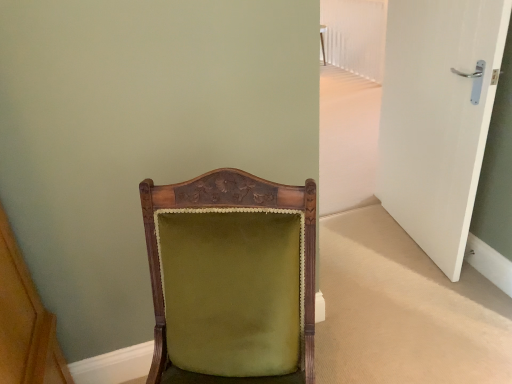
Question: Should I look upward or downward to see velvet green chair at center?

Choices:
 (A) down
 (B) up

Answer: (A)

Question: Considering the relative positions of velvet green chair at center and white glossy door at right in the image provided, is velvet green chair at center in front of white glossy door at right?

Choices:
 (A) no
 (B) yes

Answer: (B)

Question: Is velvet green chair at center in contact with white glossy door at right?

Choices:
 (A) yes
 (B) no

Answer: (B)

Question: Does velvet green chair at center turn towards white glossy door at right?

Choices:
 (A) yes
 (B) no

Answer: (B)

Question: Is velvet green chair at center oriented away from white glossy door at right?

Choices:
 (A) no
 (B) yes

Answer: (A)

Question: Is velvet green chair at center not close to white glossy door at right?

Choices:
 (A) no
 (B) yes

Answer: (B)

Question: Considering the relative sizes of velvet green chair at center and white glossy door at right in the image provided, is velvet green chair at center thinner than white glossy door at right?

Choices:
 (A) yes
 (B) no

Answer: (B)

Question: From the image's perspective, does white glossy door at right appear lower than velvet green chair at center?

Choices:
 (A) yes
 (B) no

Answer: (B)

Question: Is white glossy door at right positioned with its back to velvet green chair at center?

Choices:
 (A) no
 (B) yes

Answer: (A)

Question: Is white glossy door at right directly adjacent to velvet green chair at center?

Choices:
 (A) no
 (B) yes

Answer: (A)

Question: Considering the relative sizes of white glossy door at right and velvet green chair at center in the image provided, is white glossy door at right smaller than velvet green chair at center?

Choices:
 (A) no
 (B) yes

Answer: (B)

Question: Does white glossy door at right have a lesser height compared to velvet green chair at center?

Choices:
 (A) yes
 (B) no

Answer: (B)

Question: Is white glossy door at right outside velvet green chair at center?

Choices:
 (A) yes
 (B) no

Answer: (A)

Question: Considering the positions of white glossy door at right and velvet green chair at center in the image, is white glossy door at right bigger or smaller than velvet green chair at center?

Choices:
 (A) big
 (B) small

Answer: (B)